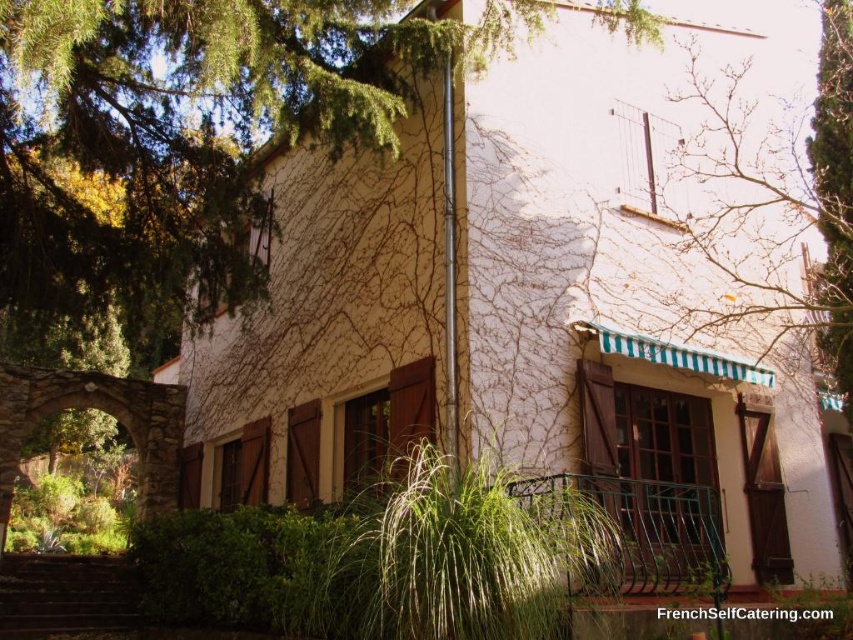
Question: Which point is farther from the camera taking this photo?

Choices:
 (A) (41, 609)
 (B) (468, 547)

Answer: (A)

Question: Does green ivy at center have a greater width compared to brown wooden stairs at lower left?

Choices:
 (A) yes
 (B) no

Answer: (B)

Question: Does green striped awning at upper right have a lesser width compared to brown wooden stairs at lower left?

Choices:
 (A) yes
 (B) no

Answer: (B)

Question: Which object is positioned farthest from the brown wooden stairs at lower left?

Choices:
 (A) green leafy tree at upper left
 (B) green ivy at center
 (C) green striped awning at upper right

Answer: (A)

Question: Which object is positioned closest to the brown wooden stairs at lower left?

Choices:
 (A) green striped awning at upper right
 (B) green ivy at center

Answer: (B)

Question: Does green leafy tree at upper left appear on the left side of green ivy at center?

Choices:
 (A) yes
 (B) no

Answer: (B)